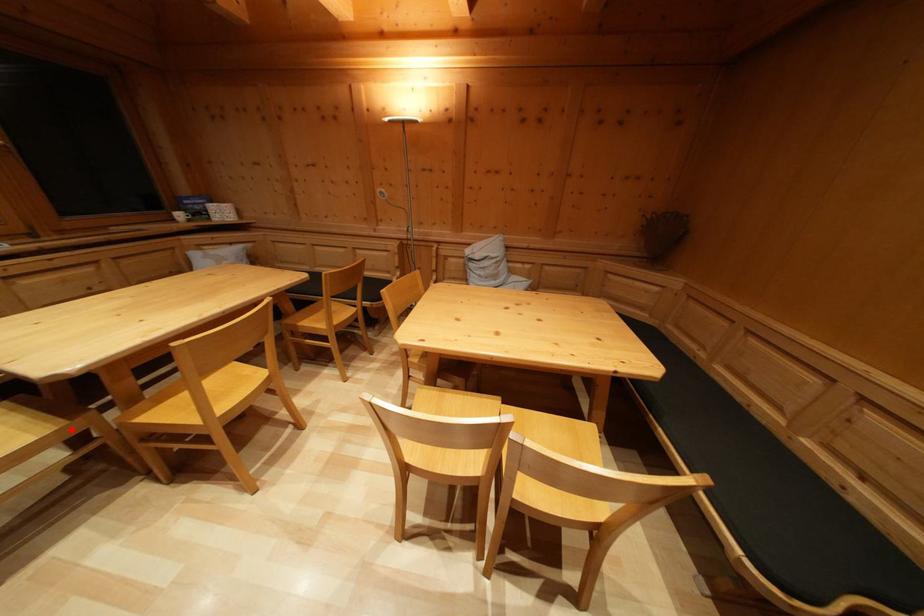
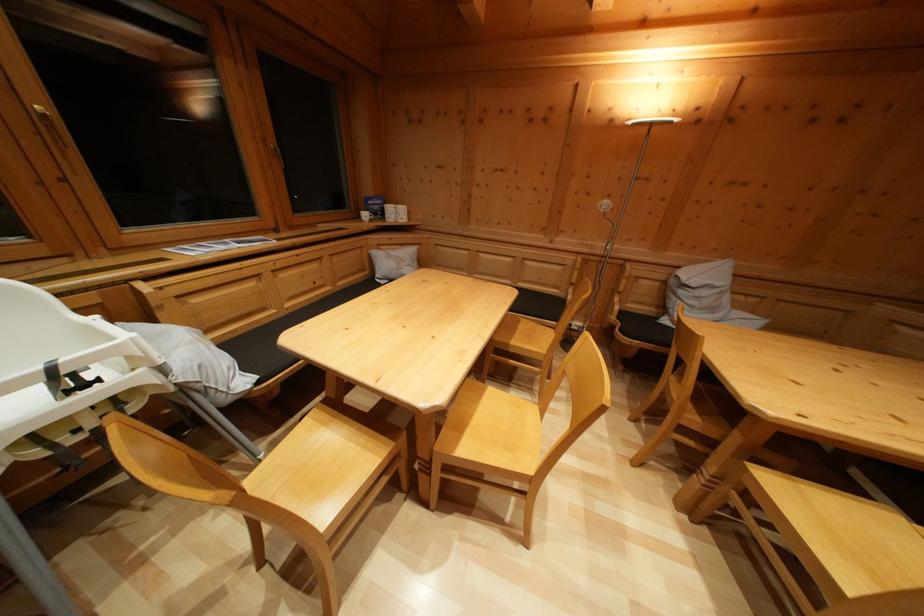
Question: I am providing you with two images of the same scene from different viewpoints. A red point is shown in image1. For the corresponding object point in image2, is it positioned nearer or farther from the camera?

Choices:
 (A) Nearer
 (B) Farther

Answer: (A)